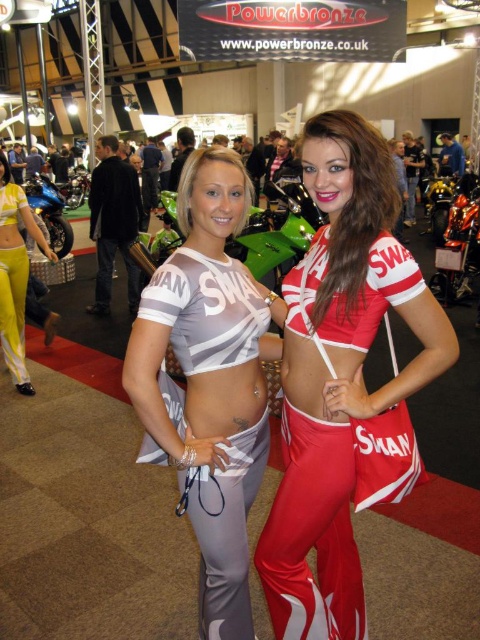
Who is more forward, (x=244, y=580) or (x=3, y=310)?

Point (x=244, y=580) is more forward.

The image size is (480, 640). What do you see at coordinates (210, 378) in the screenshot?
I see `matte gray fabric top at center` at bounding box center [210, 378].

Who is more forward, (203, 516) or (2, 163)?

Positioned in front is point (203, 516).

Locate an element on the screen. Image resolution: width=480 pixels, height=640 pixels. matte gray fabric top at center is located at coordinates (210, 378).

Can you confirm if matte red fabric outfit at center is taller than matte gray fabric top at center?

Correct, matte red fabric outfit at center is much taller as matte gray fabric top at center.

Can you confirm if matte red fabric outfit at center is bigger than matte gray fabric top at center?

Yes, matte red fabric outfit at center is bigger than matte gray fabric top at center.

The height and width of the screenshot is (640, 480). Find the location of `matte red fabric outfit at center`. matte red fabric outfit at center is located at coordinates (338, 374).

The height and width of the screenshot is (640, 480). What are the coordinates of `matte red fabric outfit at center` in the screenshot? It's located at (338, 374).

The height and width of the screenshot is (640, 480). Describe the element at coordinates (210, 378) in the screenshot. I see `matte gray fabric top at center` at that location.

Is point (264, 396) in front of point (33, 180)?

That is True.

Is point (252, 449) farther from viewer compared to point (57, 200)?

No.

This screenshot has width=480, height=640. Find the location of `matte gray fabric top at center`. matte gray fabric top at center is located at coordinates (210, 378).